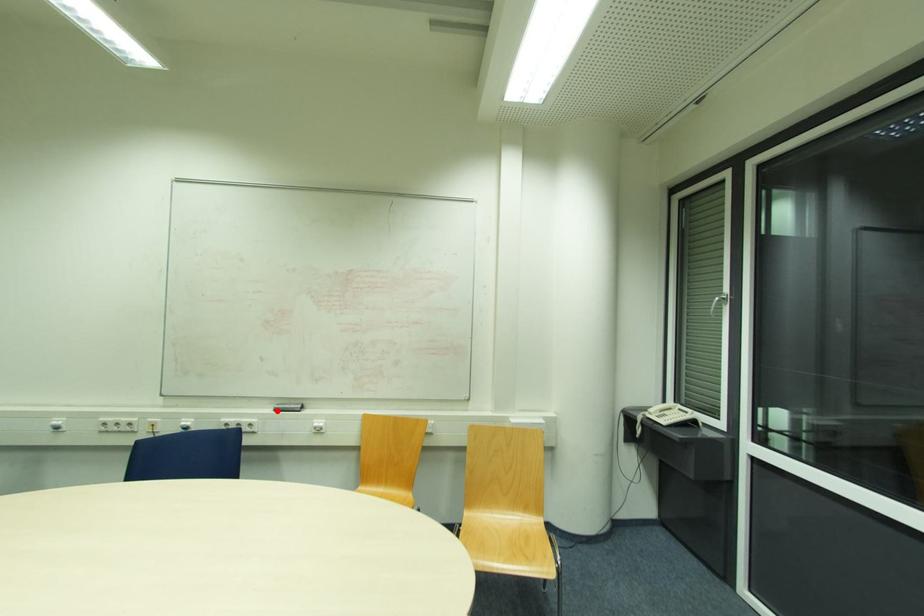
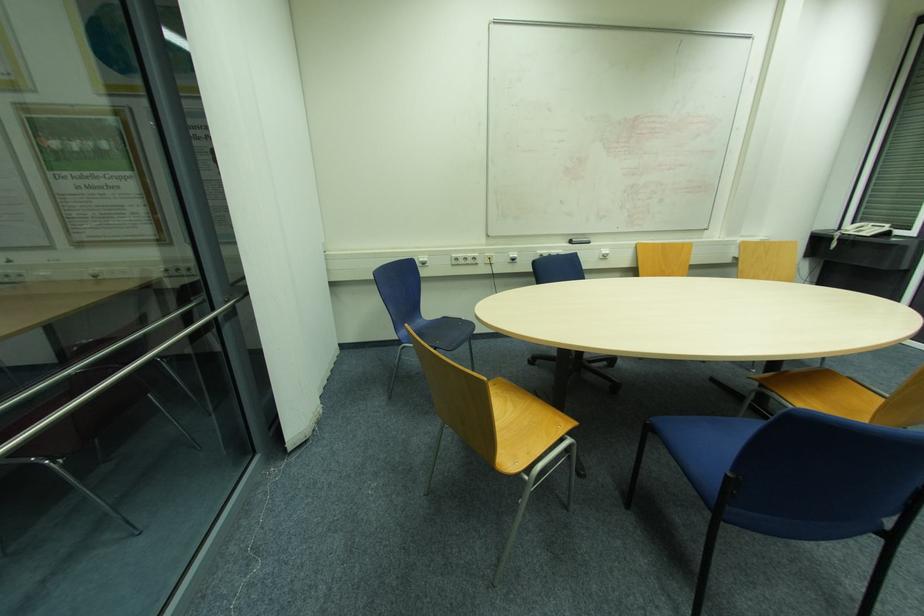
The point at the highlighted location is marked in the first image. Where is the corresponding point in the second image?

(574, 244)